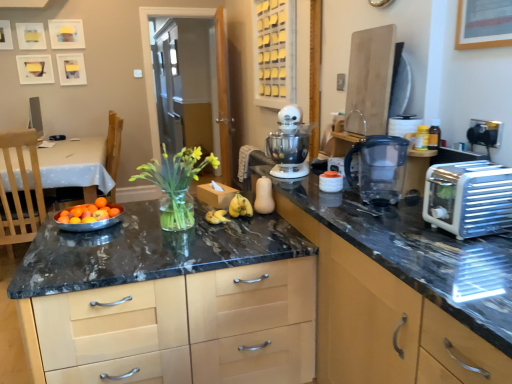
Question: In the image, is matte wood cabinet at upper center, acting as the 3th cabinetry starting from the bottom, positioned in front of or behind white plastic stand mixer at center?

Choices:
 (A) behind
 (B) front

Answer: (A)

Question: Do you think matte wood cabinet at upper center, acting as the 3th cabinetry starting from the bottom, is within white plastic stand mixer at center, or outside of it?

Choices:
 (A) outside
 (B) inside

Answer: (A)

Question: Considering the real-world distances, which object is closest to the wooden chair at left?

Choices:
 (A) matte black toaster at right, the 2th cabinetry positioned from the top
 (B) matte wood cabinet at upper center, acting as the 3th cabinetry starting from the bottom
 (C) yellow matte bananas at center
 (D) clear glass door at center
 (E) matte black countertop at center, which is the first cabinetry in bottom-to-top order

Answer: (E)

Question: Which object is positioned farthest from the wooden chair at left?

Choices:
 (A) clear glass door at center
 (B) matte black countertop at center, which is the first cabinetry in bottom-to-top order
 (C) translucent glass vase at center
 (D) matte black toaster at right, the 2th cabinetry positioned from the top
 (E) white plastic stand mixer at center

Answer: (D)